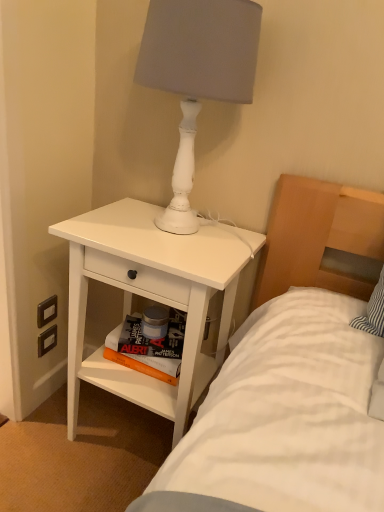
Question: From a real-world perspective, is white matte nightstand at lower left on black plastic electric outlet at lower left, the second electric outlet positioned from the top?

Choices:
 (A) no
 (B) yes

Answer: (B)

Question: Would you say white matte nightstand at lower left contains black plastic electric outlet at lower left, the second electric outlet positioned from the top?

Choices:
 (A) no
 (B) yes

Answer: (A)

Question: Does white matte nightstand at lower left lie in front of black plastic electric outlet at lower left, the second electric outlet positioned from the top?

Choices:
 (A) no
 (B) yes

Answer: (B)

Question: Is white matte nightstand at lower left positioned beyond the bounds of black plastic electric outlet at lower left, the second electric outlet positioned from the top?

Choices:
 (A) no
 (B) yes

Answer: (B)

Question: Considering the relative sizes of white matte nightstand at lower left and black plastic electric outlet at lower left, the 1th electric outlet from the bottom, in the image provided, is white matte nightstand at lower left bigger than black plastic electric outlet at lower left, the 1th electric outlet from the bottom,?

Choices:
 (A) yes
 (B) no

Answer: (A)

Question: Is point (52, 340) positioned closer to the camera than point (129, 355)?

Choices:
 (A) closer
 (B) farther

Answer: (B)

Question: From a real-world perspective, is black plastic electric outlet at lower left, the second electric outlet positioned from the top, positioned above or below orange matte book at lower center, the first magazine in the bottom-to-top sequence?

Choices:
 (A) above
 (B) below

Answer: (B)

Question: Looking at their shapes, would you say black plastic electric outlet at lower left, the second electric outlet positioned from the top, is wider or thinner than orange matte book at lower center, the first magazine in the bottom-to-top sequence?

Choices:
 (A) wide
 (B) thin

Answer: (B)

Question: From the image's perspective, is black plastic electric outlet at lower left, the 1th electric outlet from the bottom, above or below orange matte book at lower center, which is the 2th magazine from top to bottom?

Choices:
 (A) above
 (B) below

Answer: (A)

Question: Is white matte nightstand at lower left wider or thinner than white matte lamp at upper right?

Choices:
 (A) wide
 (B) thin

Answer: (A)

Question: In terms of size, does white matte nightstand at lower left appear bigger or smaller than white matte lamp at upper right?

Choices:
 (A) small
 (B) big

Answer: (B)

Question: Is white matte nightstand at lower left in front of or behind white matte lamp at upper right in the image?

Choices:
 (A) behind
 (B) front

Answer: (A)

Question: Based on their positions, is white matte nightstand at lower left located to the left or right of white matte lamp at upper right?

Choices:
 (A) right
 (B) left

Answer: (B)

Question: Does point (178, 65) appear closer or farther from the camera than point (155, 344)?

Choices:
 (A) closer
 (B) farther

Answer: (A)

Question: Is white matte lamp at upper right bigger or smaller than hardcover book at lower center, the 2th magazine positioned from the bottom?

Choices:
 (A) big
 (B) small

Answer: (A)